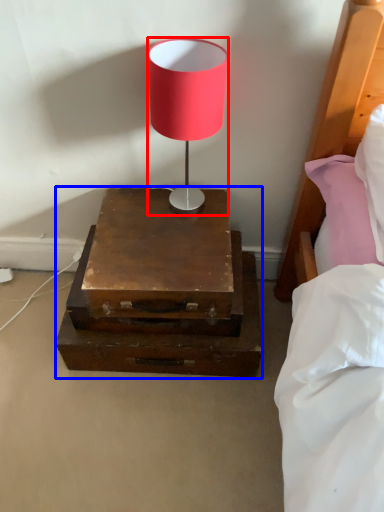
Question: Which point is closer to the camera, lamp (highlighted by a red box) or nightstand (highlighted by a blue box)?

Choices:
 (A) lamp
 (B) nightstand

Answer: (A)